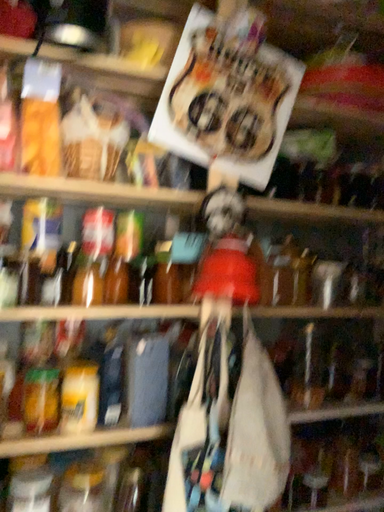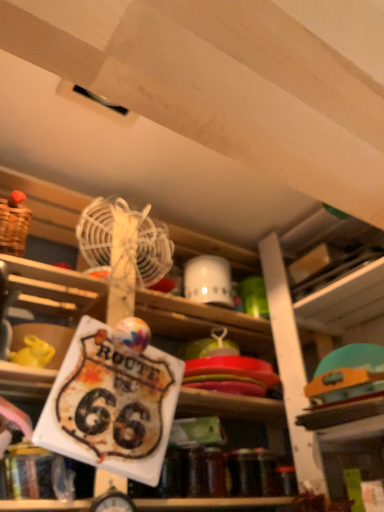
Question: Which way did the camera rotate in the video?

Choices:
 (A) rotated upward
 (B) rotated downward

Answer: (A)